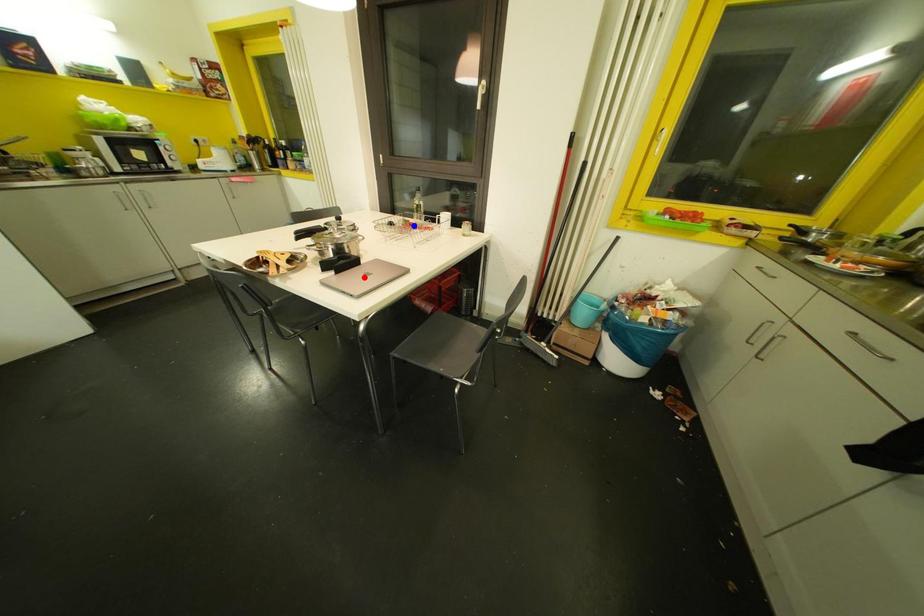
Question: Two points are marked on the image. Which point is closer to the camera?

Choices:
 (A) Blue point is closer.
 (B) Red point is closer.

Answer: (B)